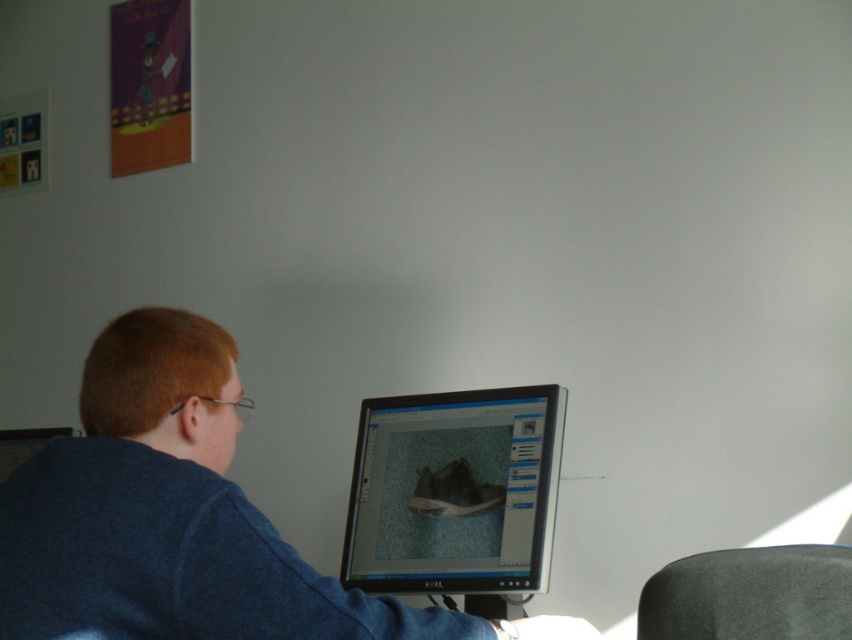
Question: Which point is closer to the camera?

Choices:
 (A) (711, 604)
 (B) (78, 541)
 (C) (532, 451)

Answer: (B)

Question: Among these objects, which one is farthest from the camera?

Choices:
 (A) satin black monitor at center
 (B) black matte chair at lower right

Answer: (A)

Question: Is blue cotton shirt at center smaller than black matte chair at lower right?

Choices:
 (A) yes
 (B) no

Answer: (B)

Question: Is blue cotton shirt at center positioned behind black matte chair at lower right?

Choices:
 (A) no
 (B) yes

Answer: (A)

Question: Among these objects, which one is nearest to the camera?

Choices:
 (A) satin black monitor at center
 (B) blue cotton shirt at center
 (C) black matte chair at lower right

Answer: (B)

Question: Is satin black monitor at center to the right of black matte chair at lower right from the viewer's perspective?

Choices:
 (A) no
 (B) yes

Answer: (A)